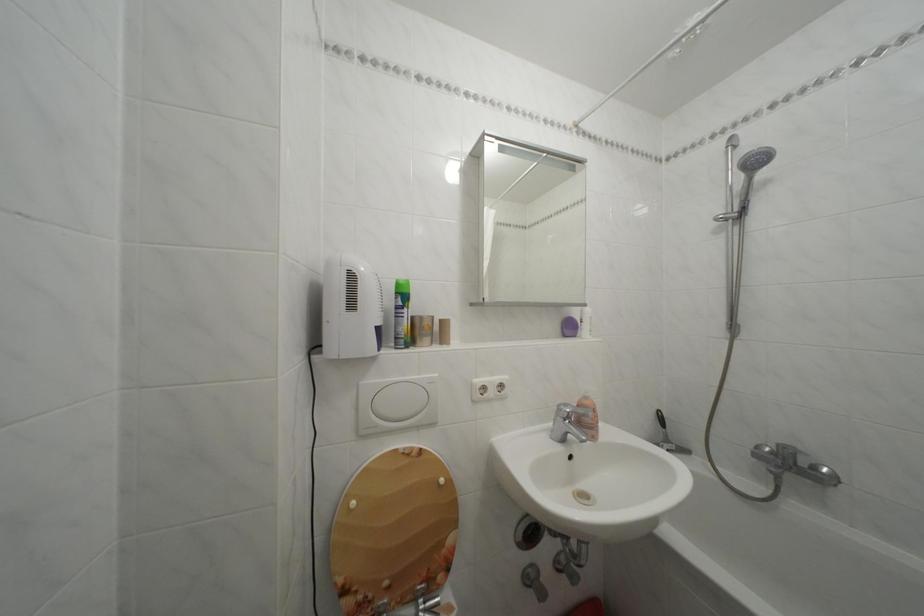
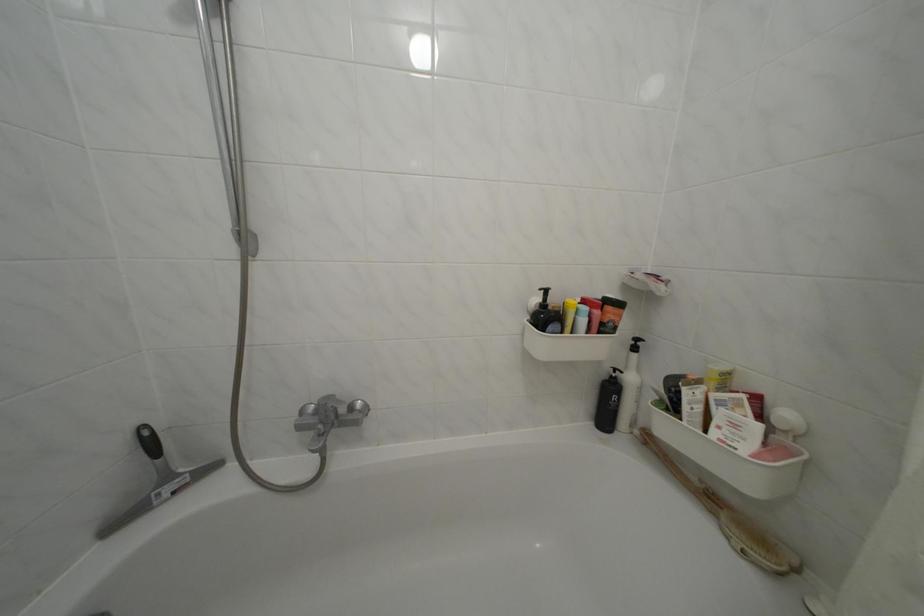
Locate, in the second image, the point that corresponds to the point at 675,447 in the first image.

(176, 484)